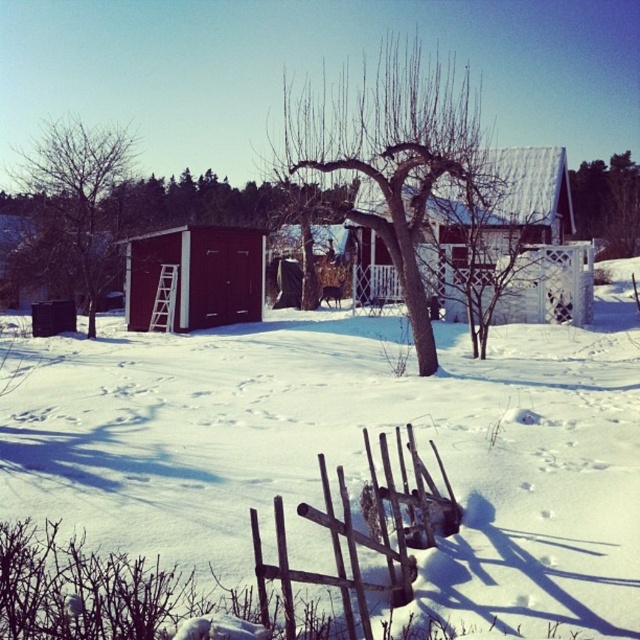
Question: Can you confirm if rusty wooden fence at lower center is positioned to the right of green leafy tree at upper right?

Choices:
 (A) no
 (B) yes

Answer: (A)

Question: Where is rusty wooden fence at lower center located in relation to dark brown wood shed at center in the image?

Choices:
 (A) right
 (B) left

Answer: (A)

Question: Among these points, which one is nearest to the camera?

Choices:
 (A) (598, 224)
 (B) (378, 241)

Answer: (B)

Question: Where is smooth brown tree trunk at left located in relation to dark brown wood shed at center in the image?

Choices:
 (A) above
 (B) below

Answer: (A)

Question: Which object is closer to the camera taking this photo?

Choices:
 (A) brown wooden shed at left
 (B) white wooden barn at center
 (C) white powdery snow at center

Answer: (C)

Question: Which point is closer to the camera taking this photo?

Choices:
 (A) (38, 228)
 (B) (392, 188)
 (C) (74, 186)

Answer: (B)